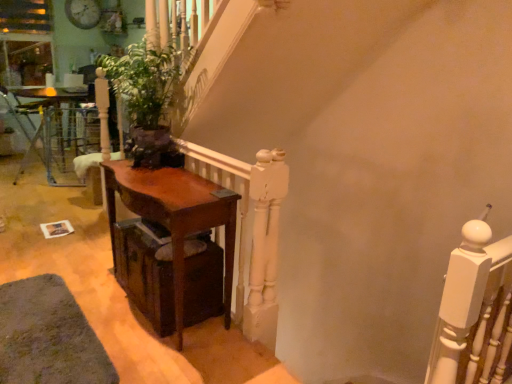
Question: Considering the relative sizes of white painted wood at upper right and mahogany wood table at center, the 1th table from the front, in the image provided, is white painted wood at upper right wider than mahogany wood table at center, the 1th table from the front,?

Choices:
 (A) no
 (B) yes

Answer: (A)

Question: From a real-world perspective, is white painted wood at upper right located higher than mahogany wood table at center, marked as the first table in a right-to-left arrangement?

Choices:
 (A) yes
 (B) no

Answer: (B)

Question: Can you confirm if white painted wood at upper right is positioned to the left of mahogany wood table at center, which is the first table from bottom to top?

Choices:
 (A) no
 (B) yes

Answer: (A)

Question: Can you confirm if white painted wood at upper right is smaller than mahogany wood table at center, the 1th table from the front?

Choices:
 (A) yes
 (B) no

Answer: (A)

Question: Is white painted wood at upper right behind mahogany wood table at center, the second table from the back?

Choices:
 (A) no
 (B) yes

Answer: (A)

Question: In the image, is dark wood drawer at lower left positioned in front of or behind green matte plant at center?

Choices:
 (A) front
 (B) behind

Answer: (B)

Question: From the image's perspective, is dark wood drawer at lower left positioned above or below green matte plant at center?

Choices:
 (A) above
 (B) below

Answer: (B)

Question: Looking at the image, does dark wood drawer at lower left seem bigger or smaller compared to green matte plant at center?

Choices:
 (A) big
 (B) small

Answer: (B)

Question: Is dark wood drawer at lower left inside the boundaries of green matte plant at center, or outside?

Choices:
 (A) inside
 (B) outside

Answer: (B)

Question: From their relative heights in the image, would you say white painted wood at upper right is taller or shorter than green matte plant at center?

Choices:
 (A) short
 (B) tall

Answer: (B)

Question: Is white painted wood at upper right bigger or smaller than green matte plant at center?

Choices:
 (A) small
 (B) big

Answer: (A)

Question: Is white painted wood at upper right in front of or behind green matte plant at center in the image?

Choices:
 (A) behind
 (B) front

Answer: (B)

Question: Do you think white painted wood at upper right is within green matte plant at center, or outside of it?

Choices:
 (A) outside
 (B) inside

Answer: (A)

Question: Would you say brown wooden table at left, which ranks as the 1th table in back-to-front order, is inside or outside dark wood drawer at lower left?

Choices:
 (A) outside
 (B) inside

Answer: (A)

Question: From a real-world perspective, relative to dark wood drawer at lower left, is brown wooden table at left, the second table positioned from the bottom, vertically above or below?

Choices:
 (A) above
 (B) below

Answer: (A)